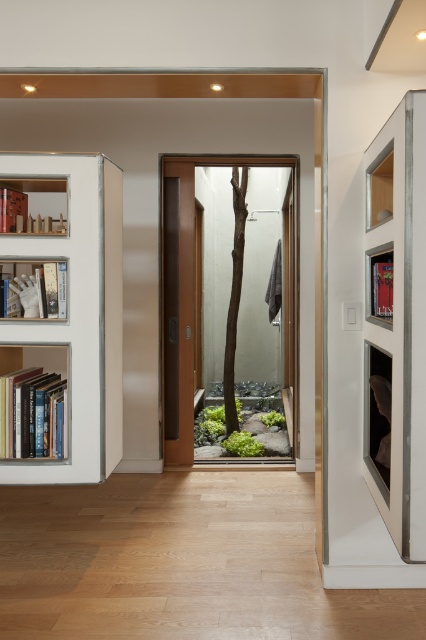
You are standing in the room and want to reach the hardcover books at left. The white wood bookcase at left is blocking your path. Can you go around it to access the books?

The white wood bookcase at left is in front of the hardcover books at left, so you can go around it to access the books since it is blocking the direct path.